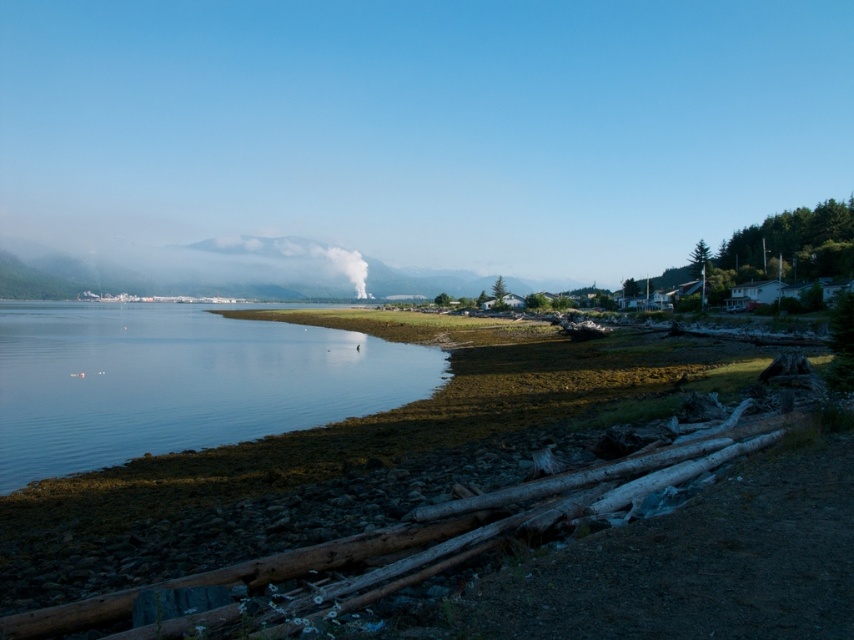
Where is `clear water at lower left`? The image size is (854, 640). clear water at lower left is located at coordinates (179, 381).

Which of these two, clear water at lower left or white smoke at center, stands taller?

white smoke at center is taller.

Does point (186, 369) lie behind point (366, 268)?

That is False.

Where is `clear water at lower left`? The image size is (854, 640). clear water at lower left is located at coordinates (179, 381).

Which is in front, point (129, 385) or point (659, 461)?

Point (659, 461) is more forward.

You are a GUI agent. You are given a task and a screenshot of the screen. Output one action in this format:
    pyautogui.click(x=<x>, y=<y>)
    Task: Click on the clear water at lower left
    Image resolution: width=854 pixels, height=640 pixels.
    Given the screenshot: What is the action you would take?
    pyautogui.click(x=179, y=381)

Which is more to the left, rusty wood logs at lower left or white smoke at center?

white smoke at center

Is point (317, 568) more distant than point (361, 269)?

No, it is not.

The image size is (854, 640). What are the coordinates of `rusty wood logs at lower left` in the screenshot? It's located at (326, 552).